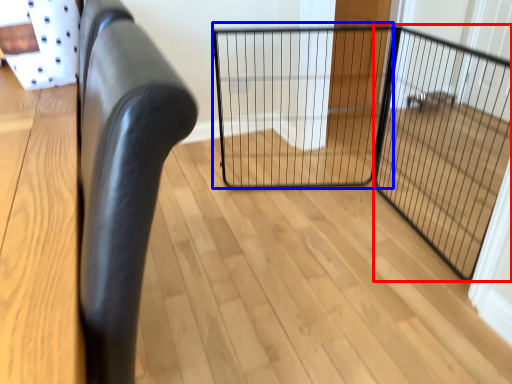
Question: Which point is further to the camera, screen door (highlighted by a red box) or cage (highlighted by a blue box)?

Choices:
 (A) screen door
 (B) cage

Answer: (B)